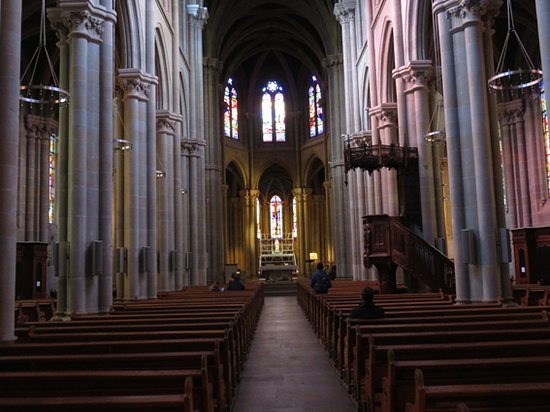
You are a GUI agent. You are given a task and a screenshot of the screen. Output one action in this format:
    pyautogui.click(x=<x>, y=<y>)
    Task: Click on the gray tiled floor
    This screenshot has width=550, height=412.
    Given the screenshot: What is the action you would take?
    pyautogui.click(x=291, y=360)